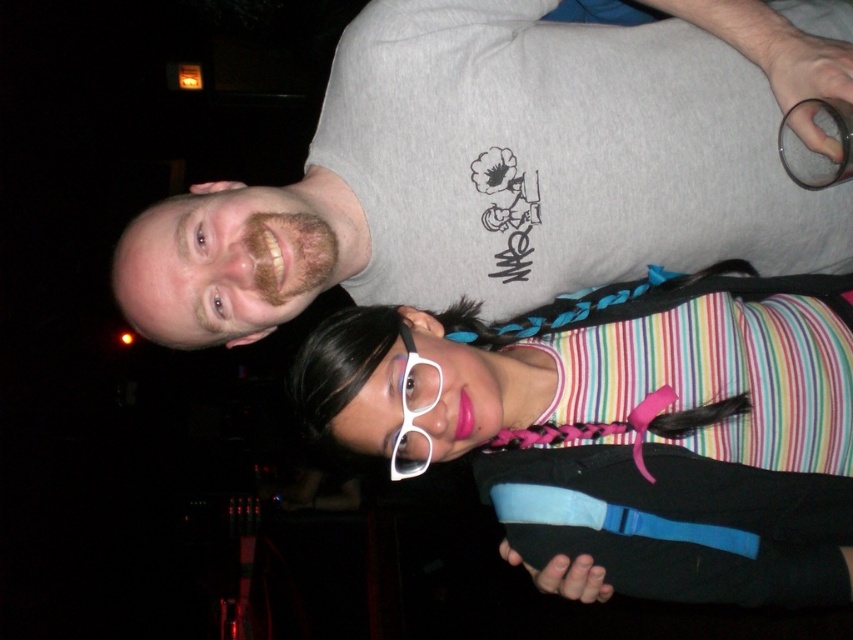
You are a photographer setting up a camera to capture the two people in the image. The camera can only focus on objects within a certain depth range. You notice two specific points marked in the scene at coordinates point (624, 4) and point (407, 346). Based on their positions, which point is closer to the camera and should be prioritized for focus to ensure clarity?

Point (624, 4) is closer to the camera than point (407, 346), so it should be prioritized for focus to ensure clarity.